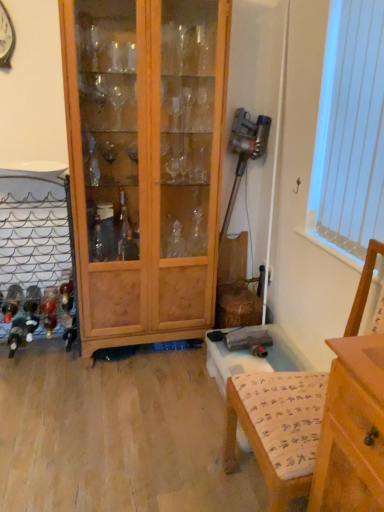
Question: Could you tell me if wooden armchair at lower right is turned towards white vertical blinds at upper right?

Choices:
 (A) no
 (B) yes

Answer: (A)

Question: Does wooden armchair at lower right appear on the right side of white vertical blinds at upper right?

Choices:
 (A) no
 (B) yes

Answer: (A)

Question: From the image's perspective, does wooden armchair at lower right appear lower than white vertical blinds at upper right?

Choices:
 (A) yes
 (B) no

Answer: (A)

Question: Considering the relative sizes of wooden armchair at lower right and white vertical blinds at upper right in the image provided, is wooden armchair at lower right taller than white vertical blinds at upper right?

Choices:
 (A) no
 (B) yes

Answer: (A)

Question: Does wooden armchair at lower right lie behind white vertical blinds at upper right?

Choices:
 (A) yes
 (B) no

Answer: (B)

Question: Considering the relative sizes of wooden armchair at lower right and white vertical blinds at upper right in the image provided, is wooden armchair at lower right wider than white vertical blinds at upper right?

Choices:
 (A) yes
 (B) no

Answer: (A)

Question: Is white vertical blinds at upper right at the right side of wooden armchair at lower right?

Choices:
 (A) yes
 (B) no

Answer: (A)

Question: Is white vertical blinds at upper right further to the viewer compared to wooden armchair at lower right?

Choices:
 (A) yes
 (B) no

Answer: (A)

Question: From a real-world perspective, is white vertical blinds at upper right physically above wooden armchair at lower right?

Choices:
 (A) no
 (B) yes

Answer: (B)

Question: Is white vertical blinds at upper right outside wooden armchair at lower right?

Choices:
 (A) yes
 (B) no

Answer: (A)

Question: Does white vertical blinds at upper right come in front of wooden armchair at lower right?

Choices:
 (A) no
 (B) yes

Answer: (A)

Question: From the image's perspective, is white vertical blinds at upper right below wooden armchair at lower right?

Choices:
 (A) no
 (B) yes

Answer: (A)

Question: Considering the relative sizes of wooden cabinet at center and white vertical blinds at upper right in the image provided, is wooden cabinet at center shorter than white vertical blinds at upper right?

Choices:
 (A) yes
 (B) no

Answer: (B)